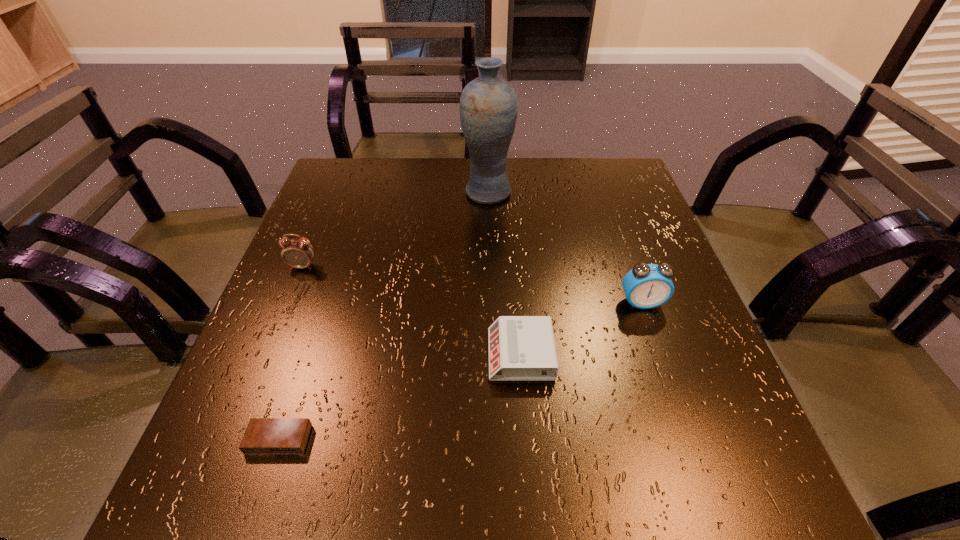
The height and width of the screenshot is (540, 960). Identify the location of vacant space located 0.340m on the face of the second farthest alarm clock. (707, 490).

This screenshot has height=540, width=960. In order to click on blank space located 0.140m on the face of the farthest alarm clock in this screenshot , I will do `click(280, 321)`.

The image size is (960, 540). I want to click on free point located on the left of the second alarm clock from right to left, so click(x=395, y=354).

At what (x,y) coordinates should I click in order to perform the action: click on free space located on the front face of the nearest object. Please return your answer as a coordinate pair (x, y). Looking at the image, I should click on (260, 496).

Identify the location of object located at the far edge. This screenshot has width=960, height=540. (488, 107).

You are a GUI agent. You are given a task and a screenshot of the screen. Output one action in this format:
    pyautogui.click(x=<x>, y=<y>)
    Task: Click on the object present at the near edge
    Image resolution: width=960 pixels, height=540 pixels.
    Given the screenshot: What is the action you would take?
    pyautogui.click(x=263, y=435)

Image resolution: width=960 pixels, height=540 pixels. In order to click on object that is at the right edge in this screenshot , I will do `click(646, 286)`.

Where is `object that is positioned at the near left corner`? The height and width of the screenshot is (540, 960). object that is positioned at the near left corner is located at coordinates (263, 435).

Locate an element on the screen. free region at the far edge is located at coordinates (402, 174).

In the image, there is a desktop. At what (x,y) coordinates should I click in order to perform the action: click on vacant region at the near edge. Please return your answer as a coordinate pair (x, y). Looking at the image, I should click on coord(522,452).